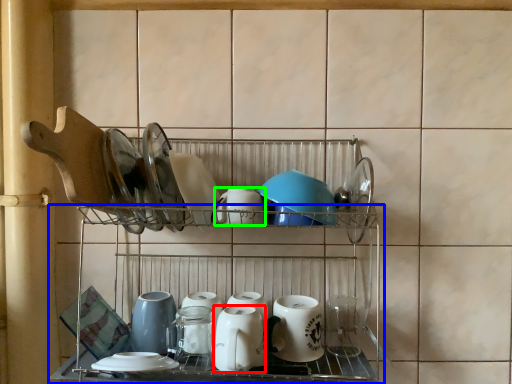
Question: Which object is the farthest from tableware (highlighted by a red box)? Choose among these: shelf (highlighted by a blue box) or tableware (highlighted by a green box).

Choices:
 (A) shelf
 (B) tableware

Answer: (B)